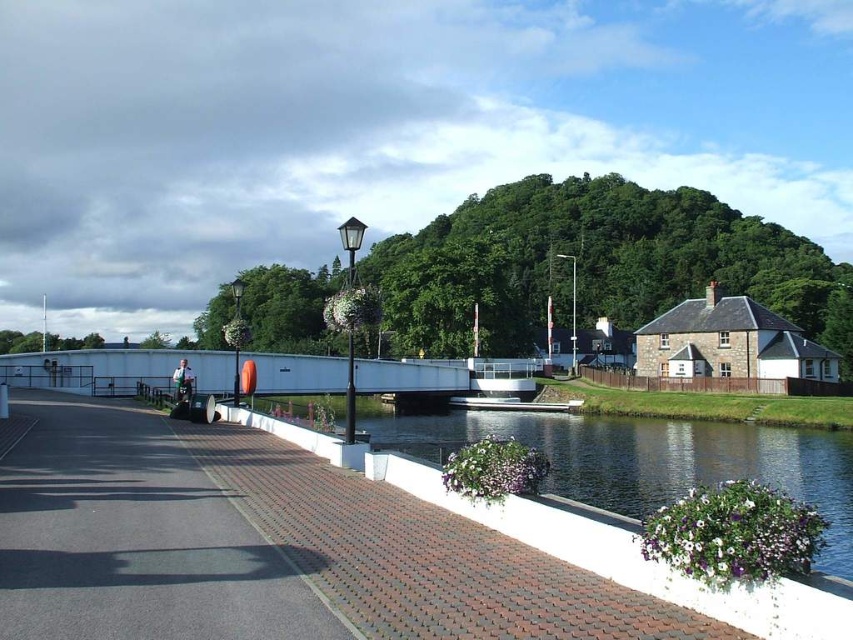
Question: Observing the image, what is the correct spatial positioning of dark gray asphalt at lower left in reference to white concrete wall at lower center?

Choices:
 (A) left
 (B) right

Answer: (A)

Question: Which point is closer to the camera?

Choices:
 (A) (88, 552)
 (B) (746, 458)

Answer: (A)

Question: Which of these objects is positioned farthest from the dark gray asphalt at lower left?

Choices:
 (A) white metallic bridge at center
 (B) white concrete wall at lower center

Answer: (A)

Question: Is white concrete wall at lower center wider than white metallic bridge at center?

Choices:
 (A) yes
 (B) no

Answer: (A)

Question: Is white concrete wall at lower center further to camera compared to white metallic bridge at center?

Choices:
 (A) no
 (B) yes

Answer: (A)

Question: Which of the following is the closest to the observer?

Choices:
 (A) dark gray asphalt at lower left
 (B) white metallic bridge at center
 (C) white concrete wall at lower center

Answer: (A)